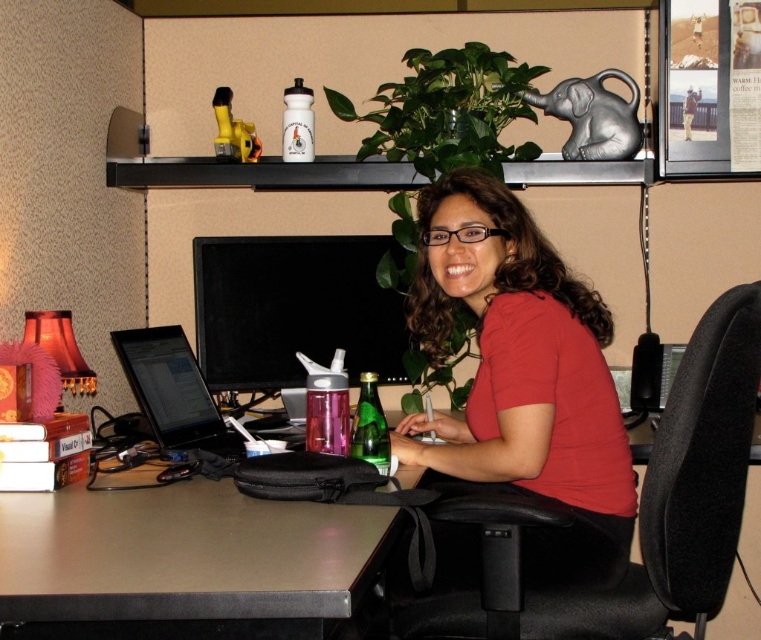
Is red matte shirt at center above metallic gray computer desk at lower left?

Indeed, red matte shirt at center is positioned over metallic gray computer desk at lower left.

Between point (540, 396) and point (298, 632), which one is positioned behind?

The point (540, 396) is behind.

Between point (572, 364) and point (164, 566), which one is positioned behind?

The point (572, 364) is more distant.

In order to click on red matte shirt at center in this screenshot , I will do `click(521, 372)`.